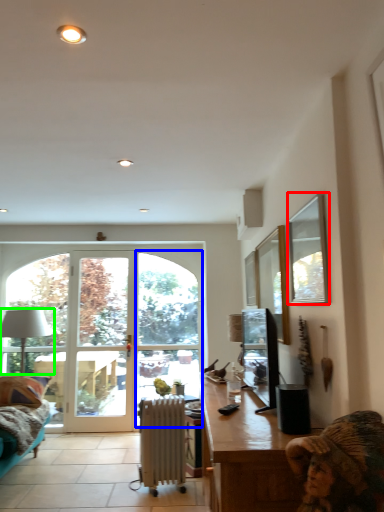
Question: Based on their relative distances, which object is farther from window screen (highlighted by a red box)? Choose from window (highlighted by a blue box) and lamp (highlighted by a green box).

Choices:
 (A) window
 (B) lamp

Answer: (B)